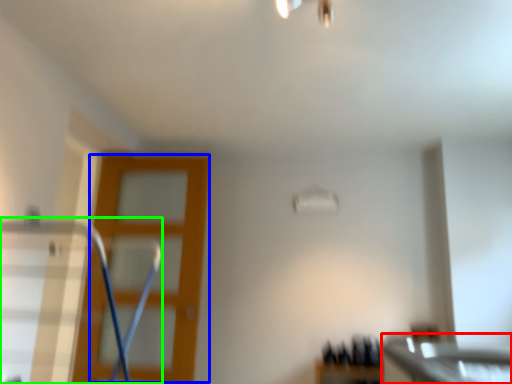
Question: Estimate the real-world distances between objects in this image. Which object is closer to counter top (highlighted by a red box), screen door (highlighted by a blue box) or swivel chair (highlighted by a green box)?

Choices:
 (A) screen door
 (B) swivel chair

Answer: (A)